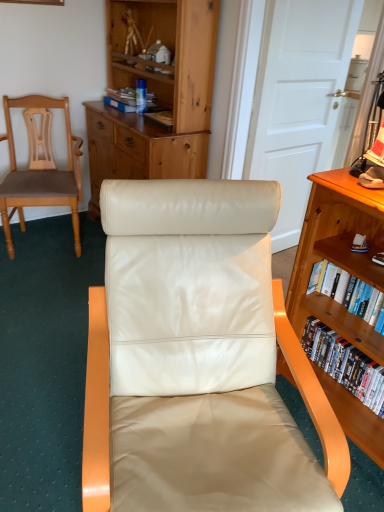
The image size is (384, 512). I want to click on vacant space that is to the left of metallic silver lamp at upper right, so click(x=345, y=179).